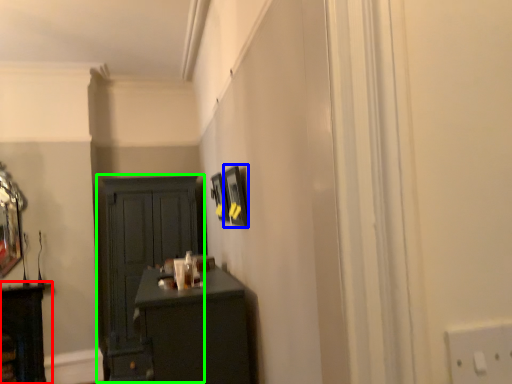
Question: Estimate the real-world distances between objects in this image. Which object is closer to cabinetry (highlighted by a red box), picture frame (highlighted by a blue box) or cupboard (highlighted by a green box)?

Choices:
 (A) picture frame
 (B) cupboard

Answer: (B)